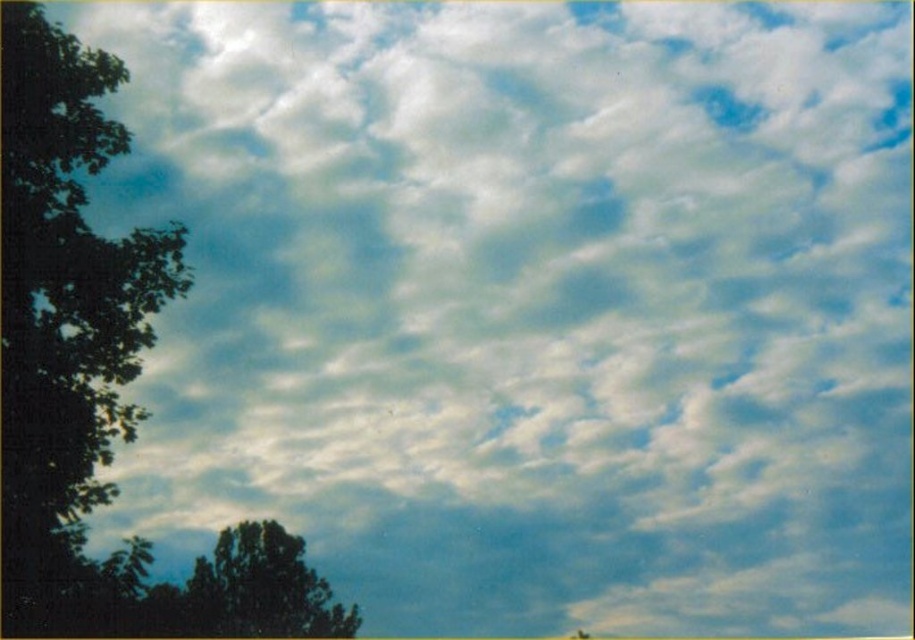
You are standing in a field looking at the sky. There is a point marked at coordinates (65, 324). According to the scene description, what object is located at that point?

The point at (65, 324) marks the green leafy tree at left.

You are standing in a field looking at the sky. You see two points in the sky labeled as point (27, 403) and point (207, 634). Which point is closer to your eyes?

Point (27, 403) is closer to the camera than point (207, 634), so the point closer to your eyes is point (27, 403).